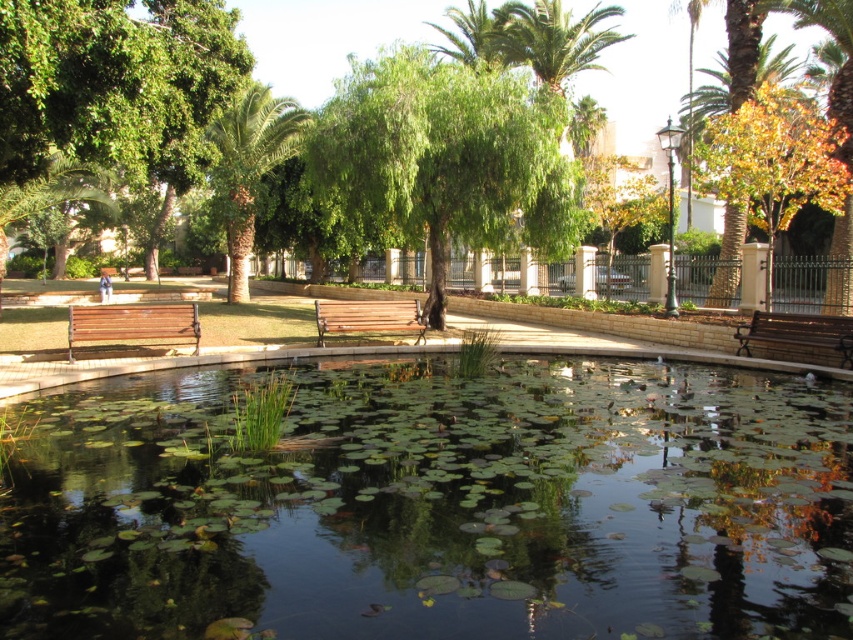
Which is more to the right, green leafy tree at center or green leafy palm tree at upper left?

green leafy tree at center

How much distance is there between green leafy tree at center and green leafy palm tree at upper left?

The distance of green leafy tree at center from green leafy palm tree at upper left is 20.69 feet.

Identify the location of green leafy tree at center. Image resolution: width=853 pixels, height=640 pixels. (445, 157).

This screenshot has width=853, height=640. In order to click on green leafy tree at center in this screenshot , I will do `click(445, 157)`.

Does point (376, 586) come closer to viewer compared to point (405, 316)?

Yes, it is.

Which of these two, green leafy water at center or wooden bench at center, stands taller?

wooden bench at center is taller.

Between point (634, 406) and point (338, 314), which one is positioned behind?

Positioned behind is point (338, 314).

The height and width of the screenshot is (640, 853). In order to click on green leafy water at center in this screenshot , I will do `click(434, 504)`.

Describe the element at coordinates (434, 504) in the screenshot. The image size is (853, 640). I see `green leafy water at center` at that location.

Is green leafy water at center thinner than green leafy palm tree at upper left?

Yes.

Between point (30, 465) and point (231, 104), which one is positioned behind?

Point (231, 104)

Where is `green leafy water at center`? The image size is (853, 640). green leafy water at center is located at coordinates (434, 504).